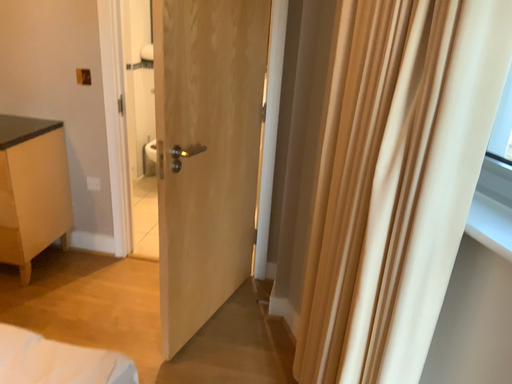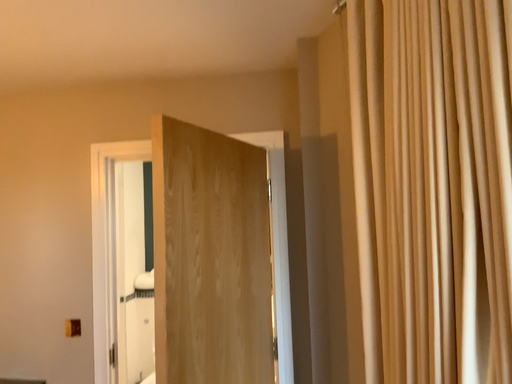
Question: How did the camera likely rotate when shooting the video?

Choices:
 (A) rotated downward
 (B) rotated upward

Answer: (B)